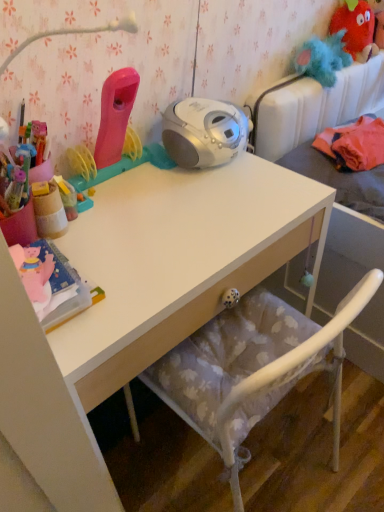
Question: Is there a large distance between fuzzy red monster at upper right and white matte desk at center?

Choices:
 (A) yes
 (B) no

Answer: (A)

Question: Would you say white matte desk at center is part of fuzzy red monster at upper right's contents?

Choices:
 (A) yes
 (B) no

Answer: (B)

Question: Does fuzzy red monster at upper right have a greater width compared to white matte desk at center?

Choices:
 (A) no
 (B) yes

Answer: (A)

Question: Does fuzzy red monster at upper right have a greater height compared to white matte desk at center?

Choices:
 (A) yes
 (B) no

Answer: (B)

Question: Can we say fuzzy red monster at upper right lies outside white matte desk at center?

Choices:
 (A) no
 (B) yes

Answer: (B)

Question: From a real-world perspective, is fuzzy red monster at upper right over white matte desk at center?

Choices:
 (A) yes
 (B) no

Answer: (A)

Question: Could you tell me if fluffy fabric bed at upper right is turned towards fuzzy red monster at upper right?

Choices:
 (A) yes
 (B) no

Answer: (B)

Question: Is fluffy fabric bed at upper right turned away from fuzzy red monster at upper right?

Choices:
 (A) yes
 (B) no

Answer: (B)

Question: Is fluffy fabric bed at upper right taller than fuzzy red monster at upper right?

Choices:
 (A) yes
 (B) no

Answer: (A)

Question: Is the position of fluffy fabric bed at upper right less distant than that of fuzzy red monster at upper right?

Choices:
 (A) yes
 (B) no

Answer: (A)

Question: Is fluffy fabric bed at upper right thinner than fuzzy red monster at upper right?

Choices:
 (A) yes
 (B) no

Answer: (B)

Question: From a real-world perspective, is fluffy fabric bed at upper right over fuzzy red monster at upper right?

Choices:
 (A) yes
 (B) no

Answer: (B)

Question: From the image's perspective, is white matte desk at center on top of fuzzy red monster at upper right?

Choices:
 (A) yes
 (B) no

Answer: (B)